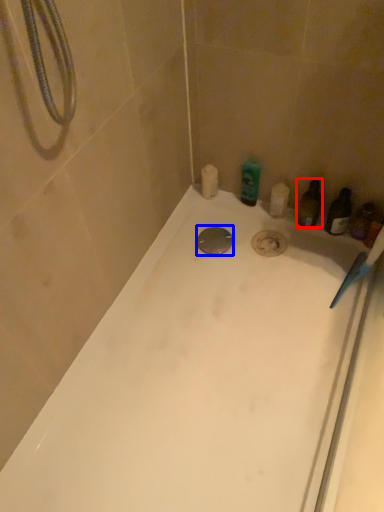
Question: Which of the following is the closest to the observer, toiletry (highlighted by a red box) or drain (highlighted by a blue box)?

Choices:
 (A) toiletry
 (B) drain

Answer: (A)